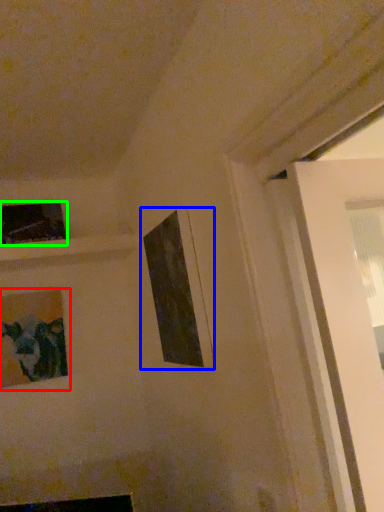
Question: Based on their relative distances, which object is farther from picture frame (highlighted by a red box)? Choose from picture frame (highlighted by a blue box) and picture frame (highlighted by a green box).

Choices:
 (A) picture frame
 (B) picture frame

Answer: (A)